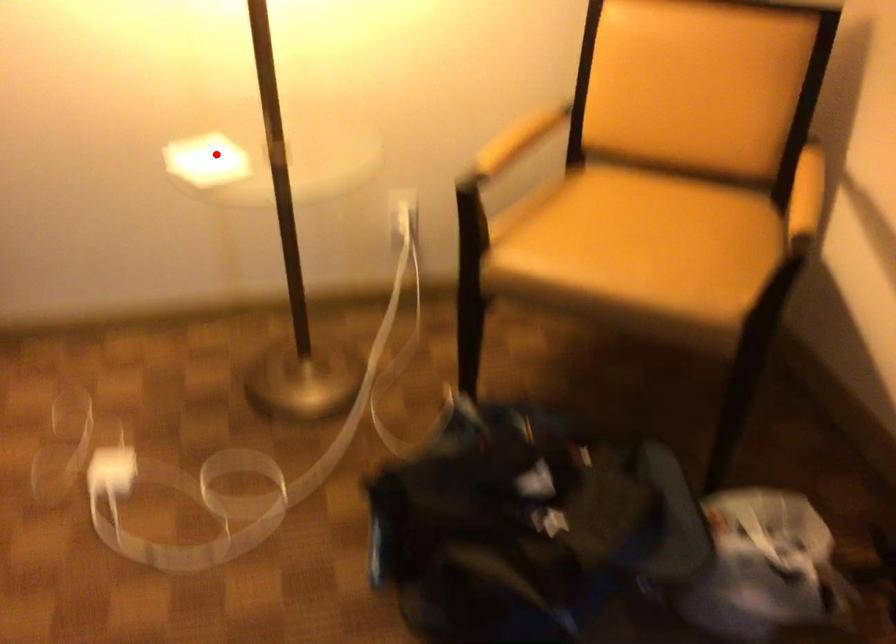
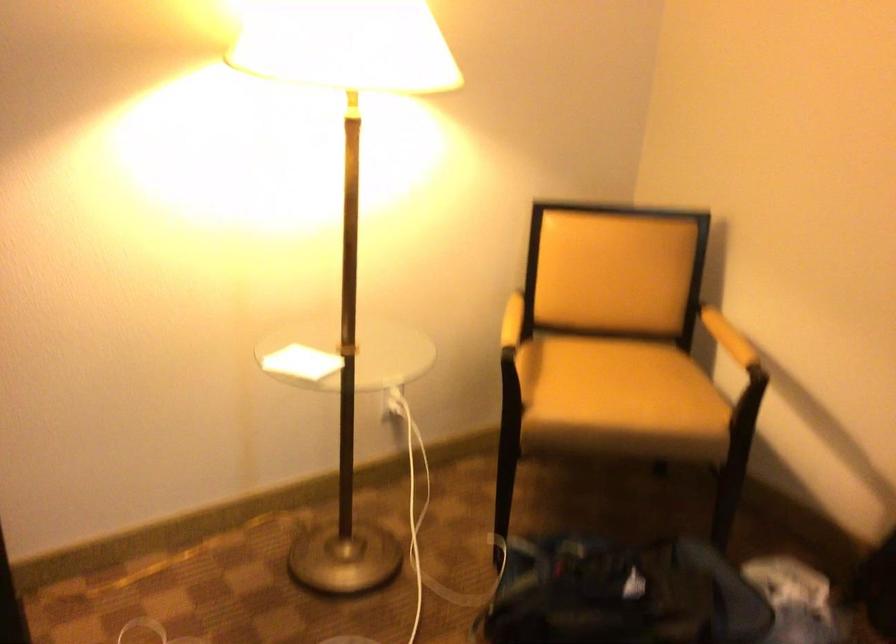
Where in the second image is the point corresponding to the highlighted location from the first image?

(300, 363)